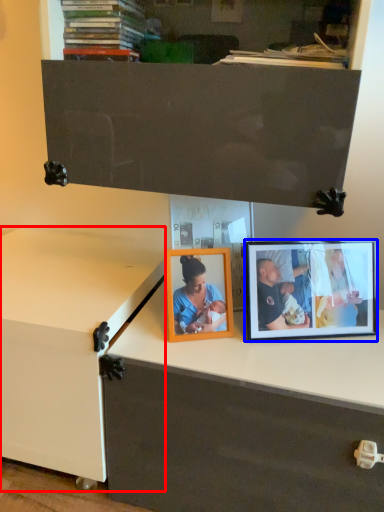
Question: Which object appears farthest to the camera in this image, changing table (highlighted by a red box) or picture frame (highlighted by a blue box)?

Choices:
 (A) changing table
 (B) picture frame

Answer: (B)